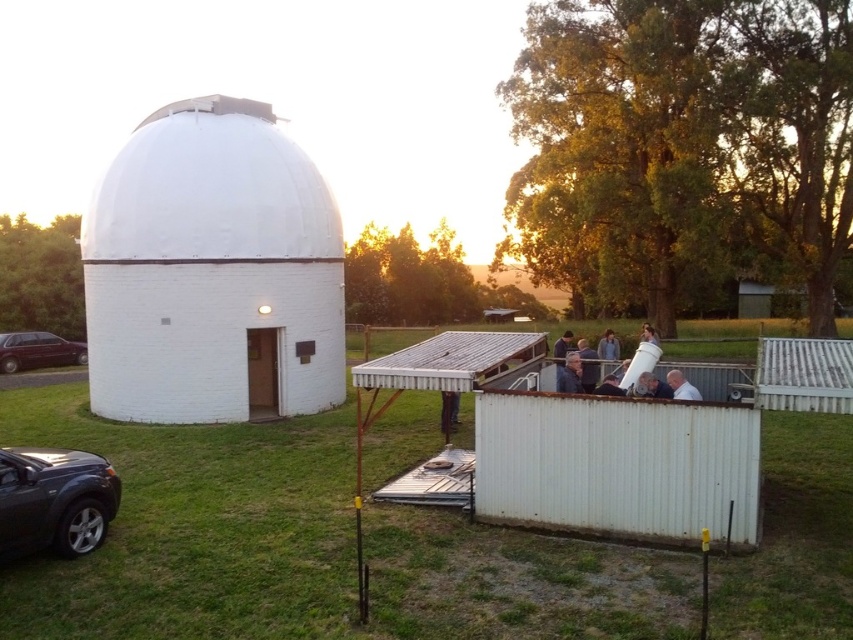
Question: Which object appears farthest from the camera in this image?

Choices:
 (A) metallic gray car at lower left
 (B) white brick observatory at left

Answer: (B)

Question: Is white brick observatory at left below dark blue jacket at center?

Choices:
 (A) no
 (B) yes

Answer: (A)

Question: Does metallic gray car at lower left appear on the left side of dark blue jacket at center?

Choices:
 (A) no
 (B) yes

Answer: (B)

Question: Does dark blue jacket at center come behind light brown wooden telescope at center?

Choices:
 (A) no
 (B) yes

Answer: (B)

Question: Which point appears farthest from the camera in this image?

Choices:
 (A) (97, 508)
 (B) (672, 371)
 (C) (54, 342)
 (D) (567, 376)

Answer: (C)

Question: Which point is farther to the camera?

Choices:
 (A) white brick observatory at left
 (B) shiny maroon sedan at lower left
 (C) metallic gray car at lower left

Answer: (B)